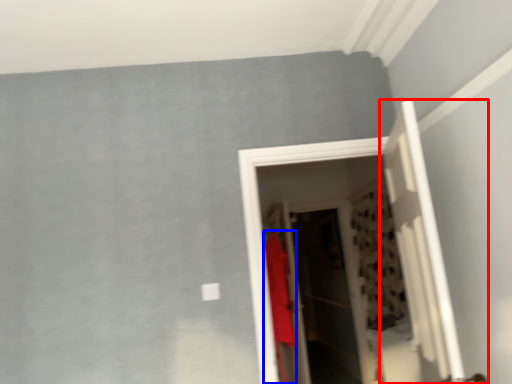
Question: Which object appears closest to the camera in this image, door (highlighted by a red box) or clothing (highlighted by a blue box)?

Choices:
 (A) door
 (B) clothing

Answer: (A)